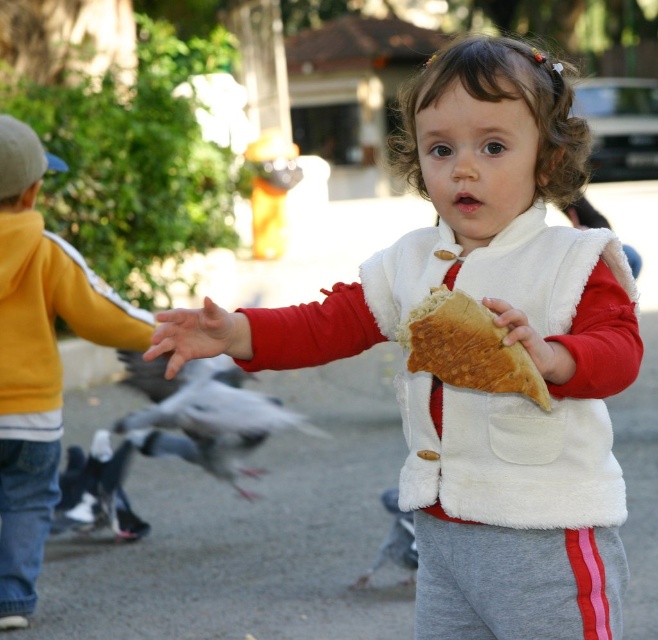
Who is higher up, yellow fleece jacket at left or golden brown crusty bread at center?

golden brown crusty bread at center

Is point (1, 396) less distant than point (422, 320)?

No, (1, 396) is further to viewer.

Between point (14, 220) and point (517, 378), which one is positioned behind?

Point (14, 220)

The width and height of the screenshot is (658, 640). Identify the location of yellow fleece jacket at left. (38, 358).

Can you confirm if gray feathered bird at lower left is positioned to the left of gray feathered bird at center?

No, gray feathered bird at lower left is not to the left of gray feathered bird at center.

Measure the distance between gray feathered bird at lower left and gray feathered bird at center.

A distance of 7.67 inches exists between gray feathered bird at lower left and gray feathered bird at center.

Between point (222, 365) and point (130, 385), which one is positioned behind?

Positioned behind is point (130, 385).

Where is `gray feathered bird at lower left`? This screenshot has width=658, height=640. gray feathered bird at lower left is located at coordinates (203, 413).

Can you confirm if gray feathered bird at lower left is positioned to the left of golden brown crusty bread at center?

Yes, gray feathered bird at lower left is to the left of golden brown crusty bread at center.

Does gray feathered bird at lower left have a lesser height compared to golden brown crusty bread at center?

No.

Who is more forward, (x=143, y=419) or (x=420, y=314)?

Point (x=420, y=314) is more forward.

This screenshot has height=640, width=658. What are the coordinates of `gray feathered bird at lower left` in the screenshot? It's located at (203, 413).